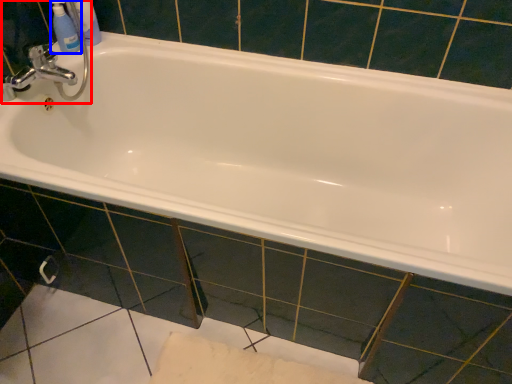
Question: Which object is further to the camera taking this photo, sink (highlighted by a red box) or mouthwash (highlighted by a blue box)?

Choices:
 (A) sink
 (B) mouthwash

Answer: (B)